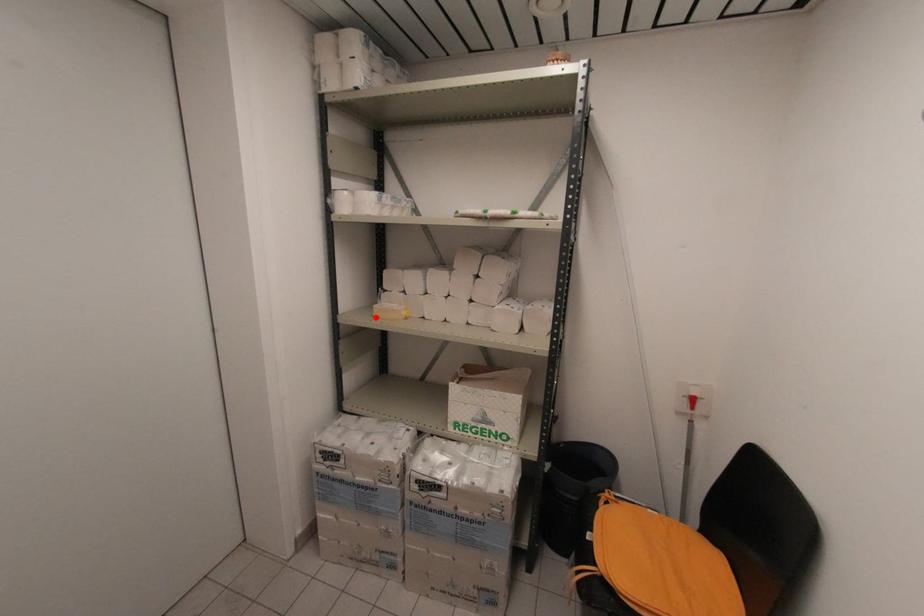
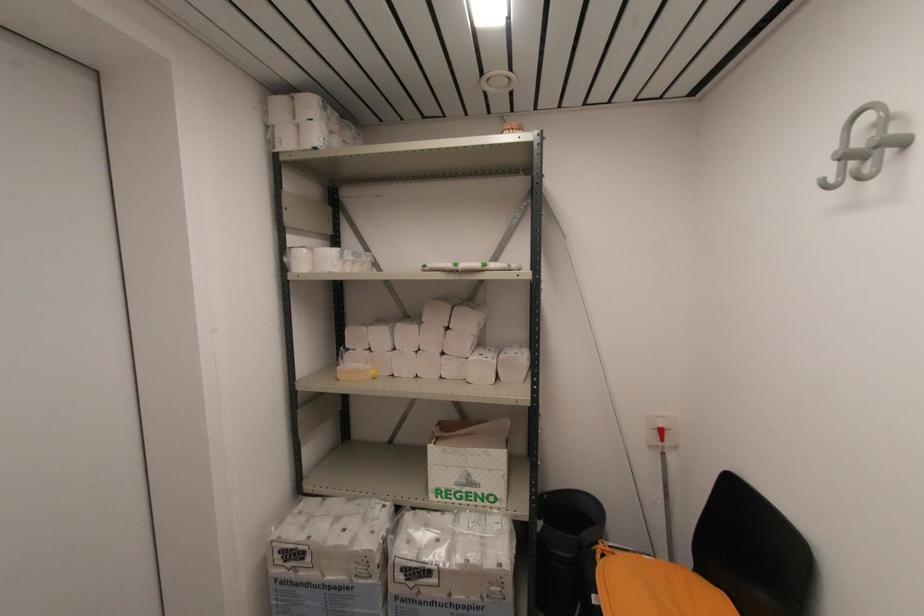
In the second image, find the point that corresponds to the highlighted location in the first image.

(339, 381)